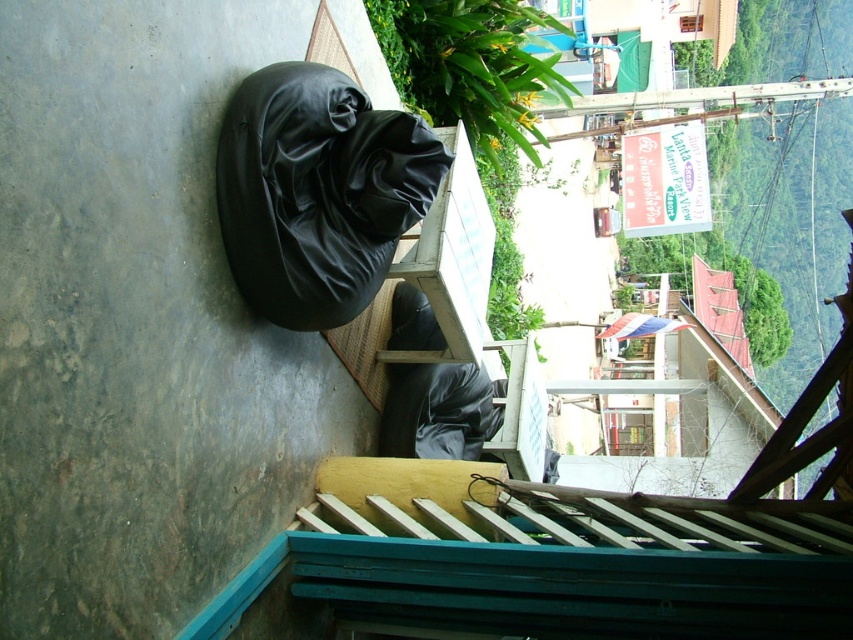
Question: Does black leather beanbag at upper left appear under matte black beanbag at center?

Choices:
 (A) no
 (B) yes

Answer: (A)

Question: Which point is farther to the camera?

Choices:
 (A) (283, 189)
 (B) (399, 310)

Answer: (B)

Question: Among these points, which one is nearest to the camera?

Choices:
 (A) (343, 156)
 (B) (419, 390)

Answer: (A)

Question: Can you confirm if black leather beanbag at upper left is thinner than matte black beanbag at center?

Choices:
 (A) yes
 (B) no

Answer: (B)

Question: Is black leather beanbag at upper left thinner than matte black beanbag at center?

Choices:
 (A) yes
 (B) no

Answer: (B)